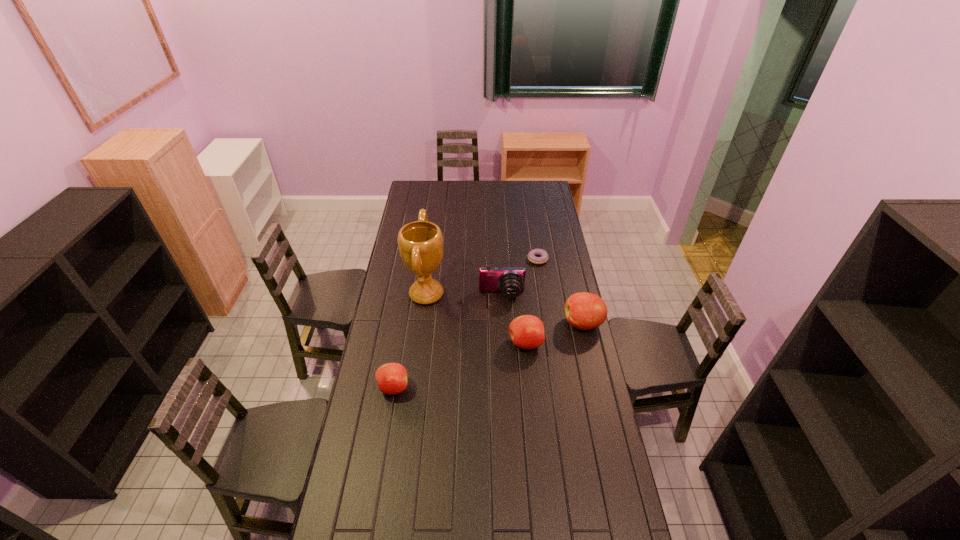
Find the location of a particular element. This screenshot has width=960, height=540. vacant space at the left edge of the desktop is located at coordinates (400, 346).

Image resolution: width=960 pixels, height=540 pixels. In order to click on free region at the right edge of the desktop in this screenshot , I will do `click(556, 323)`.

At what (x,y) coordinates should I click in order to perform the action: click on free space at the far left corner of the desktop. Please return your answer as a coordinate pair (x, y). The image size is (960, 540). Looking at the image, I should click on (416, 197).

This screenshot has width=960, height=540. In order to click on free region at the far right corner of the desktop in this screenshot , I will do `click(548, 192)`.

The width and height of the screenshot is (960, 540). What are the coordinates of `unoccupied position between the award and the camera` in the screenshot? It's located at (464, 295).

Where is `vacant space that's between the rightmost object and the camera`? The image size is (960, 540). vacant space that's between the rightmost object and the camera is located at coordinates (542, 309).

This screenshot has width=960, height=540. In order to click on free spot between the camera and the tallest object in this screenshot , I will do `click(464, 295)`.

What are the coordinates of `vacant area that lies between the tallest object and the nearest apple` in the screenshot? It's located at (410, 341).

At what (x,y) coordinates should I click in order to perform the action: click on unoccupied position between the rightmost object and the camera. Please return your answer as a coordinate pair (x, y). This screenshot has width=960, height=540. Looking at the image, I should click on (542, 309).

Identify the location of blank region between the leftmost apple and the award. (410, 341).